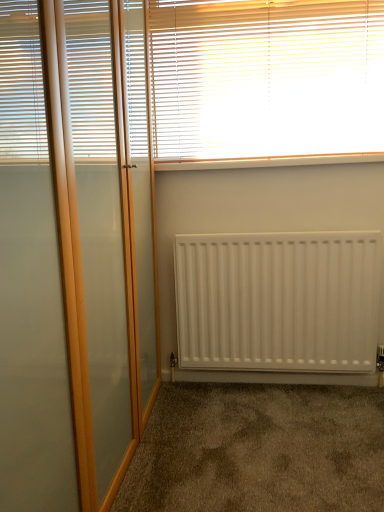
Question: From the image's perspective, is white plastic window sill at upper center above or below white wooden blinds at upper center?

Choices:
 (A) below
 (B) above

Answer: (A)

Question: Is white plastic window sill at upper center to the left or to the right of white wooden blinds at upper center in the image?

Choices:
 (A) right
 (B) left

Answer: (A)

Question: Considering the real-world distances, which object is farthest from the white wooden blinds at upper center?

Choices:
 (A) white plastic window sill at upper center
 (B) white matte radiator at center
 (C) brown carpet at lower center

Answer: (C)

Question: Estimate the real-world distances between objects in this image. Which object is farther from the white wooden blinds at upper center?

Choices:
 (A) white plastic window sill at upper center
 (B) white matte radiator at center
 (C) brown carpet at lower center

Answer: (C)